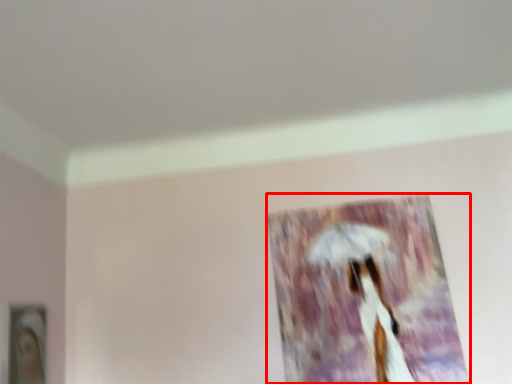
Question: From the image, what is the correct spatial relationship of picture frame (annotated by the red box) in relation to picture frame?

Choices:
 (A) right
 (B) left

Answer: (A)